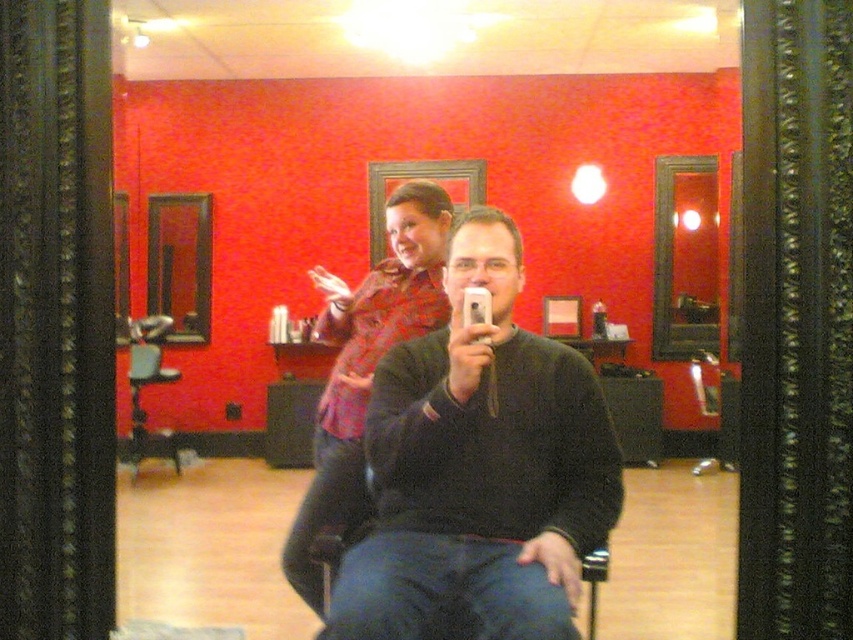
You are a customer in the hair salon and want to take a photo of both the red plaid shirt at upper center and the matte black mirror at upper right in the same frame. Which object should you position closer to the camera to ensure both are fully visible?

Since the red plaid shirt at upper center is not as tall as the matte black mirror at upper right, you should position the taller matte black mirror at upper right closer to the camera to ensure both objects are fully visible in the frame.

You are a photographer setting up a shoot in the salon. You need to position a light source to the right of the wooden frame mirror at left. Is the black matte sweater at center currently blocking that area?

The black matte sweater at center is positioned on the right side of the wooden frame mirror at left, so it is blocking the area to the right of the wooden frame mirror at left. Move the sweater or adjust the light placement accordingly.

You are a customer in a hair salon and you notice two items of clothing in the scene. The black matte sweater at center and the red plaid shirt at upper center. Which one has a shorter length?

The black matte sweater at center is shorter than the red plaid shirt at upper center.